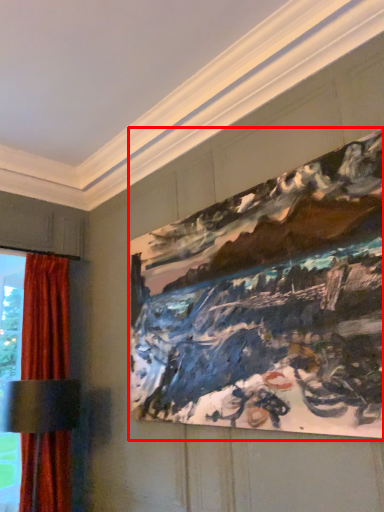
Question: From the image's perspective, where is picture frame (annotated by the red box) located in relation to curtain in the image?

Choices:
 (A) below
 (B) above

Answer: (B)